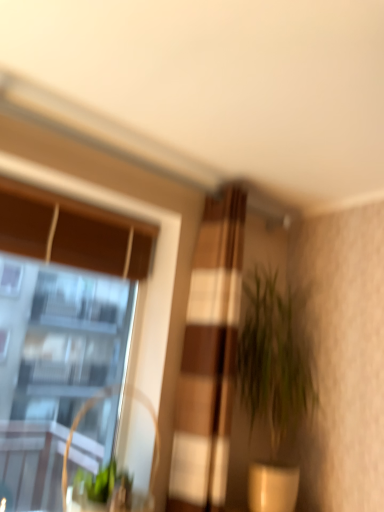
Question: Considering the positions of point (220, 404) and point (253, 293), is point (220, 404) closer or farther from the camera than point (253, 293)?

Choices:
 (A) farther
 (B) closer

Answer: (B)

Question: Relative to green leafy plant at center-right, is textured beige curtain at center in front or behind?

Choices:
 (A) behind
 (B) front

Answer: (B)

Question: Estimate the real-world distances between objects in this image. Which object is closer to the clear glass window at upper left?

Choices:
 (A) metallic silver swivel chair at left
 (B) textured beige curtain at center
 (C) green leafy plant at center-right

Answer: (C)

Question: Estimate the real-world distances between objects in this image. Which object is closer to the textured beige curtain at center?

Choices:
 (A) clear glass window at upper left
 (B) metallic silver swivel chair at left
 (C) green leafy plant at center-right

Answer: (C)